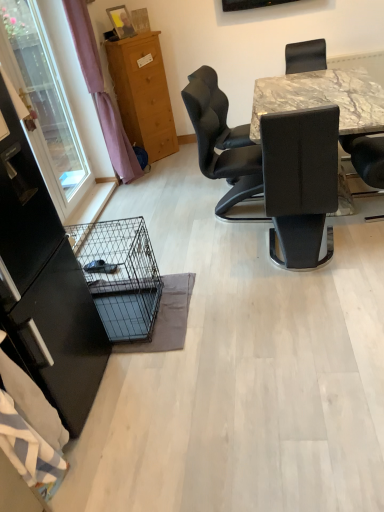
Question: Is transparent plastic window screen at left to the right of marble table at upper right from the viewer's perspective?

Choices:
 (A) yes
 (B) no

Answer: (B)

Question: From the image's perspective, would you say transparent plastic window screen at left is positioned over marble table at upper right?

Choices:
 (A) no
 (B) yes

Answer: (B)

Question: Are transparent plastic window screen at left and marble table at upper right located far from each other?

Choices:
 (A) no
 (B) yes

Answer: (B)

Question: Can you confirm if transparent plastic window screen at left is bigger than marble table at upper right?

Choices:
 (A) no
 (B) yes

Answer: (A)

Question: From the image's perspective, is transparent plastic window screen at left located beneath marble table at upper right?

Choices:
 (A) yes
 (B) no

Answer: (B)

Question: Considering the relative positions of transparent glass screen door at left and black leather chair at center in the image provided, is transparent glass screen door at left to the left or to the right of black leather chair at center?

Choices:
 (A) left
 (B) right

Answer: (A)

Question: Is point (11, 246) closer or farther from the camera than point (261, 153)?

Choices:
 (A) closer
 (B) farther

Answer: (A)

Question: Based on their sizes in the image, would you say transparent glass screen door at left is bigger or smaller than black leather chair at center?

Choices:
 (A) big
 (B) small

Answer: (B)

Question: From a real-world perspective, is transparent glass screen door at left physically located above or below black leather chair at center?

Choices:
 (A) below
 (B) above

Answer: (B)

Question: Considering the positions of marble table at upper right and black wire mesh cage at lower left in the image, is marble table at upper right bigger or smaller than black wire mesh cage at lower left?

Choices:
 (A) big
 (B) small

Answer: (A)

Question: Is marble table at upper right inside or outside of black wire mesh cage at lower left?

Choices:
 (A) inside
 (B) outside

Answer: (B)

Question: Considering the positions of marble table at upper right and black wire mesh cage at lower left in the image, is marble table at upper right wider or thinner than black wire mesh cage at lower left?

Choices:
 (A) wide
 (B) thin

Answer: (A)

Question: Is marble table at upper right to the left or to the right of black wire mesh cage at lower left in the image?

Choices:
 (A) right
 (B) left

Answer: (A)

Question: In the image, is marble table at upper right positioned in front of or behind black leather chair at center?

Choices:
 (A) behind
 (B) front

Answer: (B)

Question: Does point pyautogui.click(x=291, y=84) appear closer or farther from the camera than point pyautogui.click(x=193, y=83)?

Choices:
 (A) closer
 (B) farther

Answer: (B)